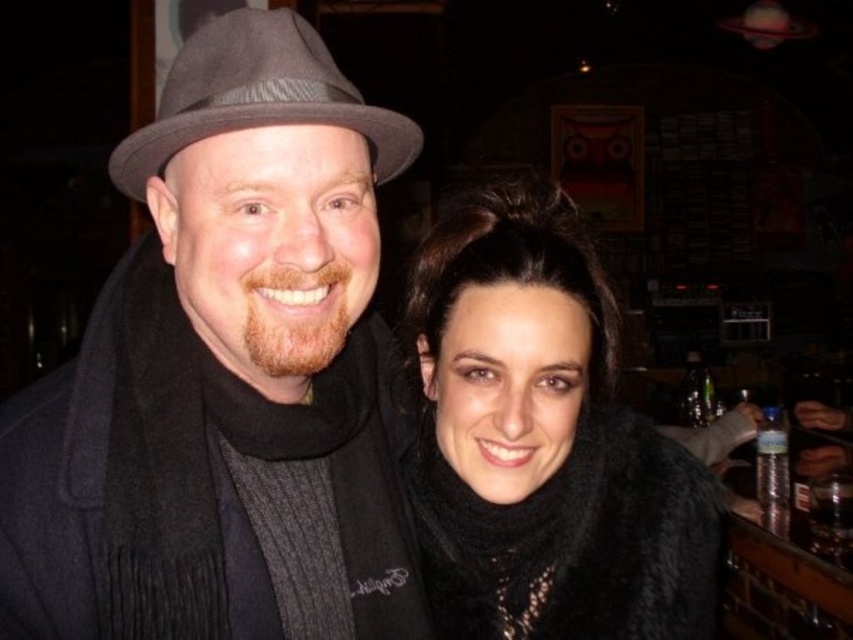
Question: In this image, where is matte black coat at left located relative to gray felt fedora at upper left?

Choices:
 (A) below
 (B) above

Answer: (A)

Question: Considering the real-world distances, which object is farthest from the black fuzzy scarf at right?

Choices:
 (A) matte black coat at left
 (B) gray felt fedora at upper left

Answer: (B)

Question: Among these points, which one is farthest from the camera?

Choices:
 (A) (277, 88)
 (B) (531, 376)

Answer: (B)

Question: Among these points, which one is farthest from the camera?

Choices:
 (A) (111, 387)
 (B) (323, 51)

Answer: (A)

Question: Does matte black coat at left have a larger size compared to gray felt fedora at upper left?

Choices:
 (A) yes
 (B) no

Answer: (A)

Question: Can you confirm if matte black coat at left is smaller than gray felt fedora at upper left?

Choices:
 (A) yes
 (B) no

Answer: (B)